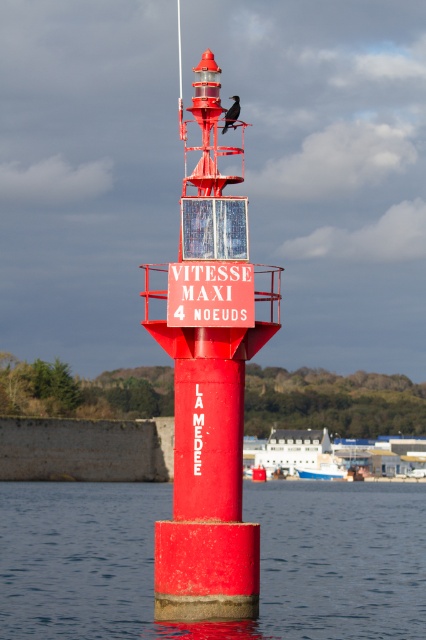
You are a sailor approaching the harbor and see the smooth concrete water at center and the matte red buoy at center. Which object is positioned higher from the water surface?

The matte red buoy at center is positioned higher from the water surface than the smooth concrete water at center because the smooth concrete water at center is located below it.